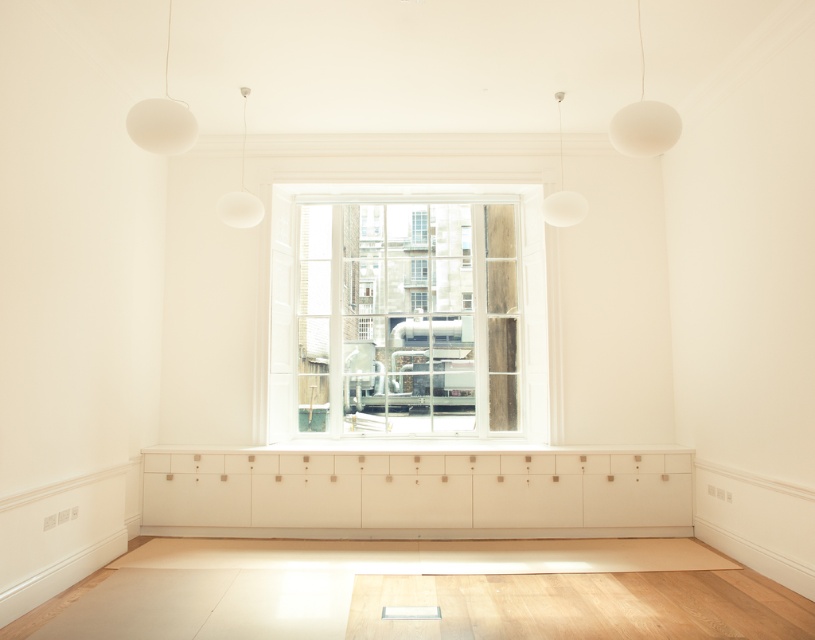
You are standing in the room and want to place a new piece of furniture. The white matte cabinet at center is currently located at coordinates 0.772, 0.513. If you want to place a new shelf directly to the right of it, what coordinates should you aim for?

To place a new shelf directly to the right of the white matte cabinet at center, you should aim for coordinates approximately (417, 557).